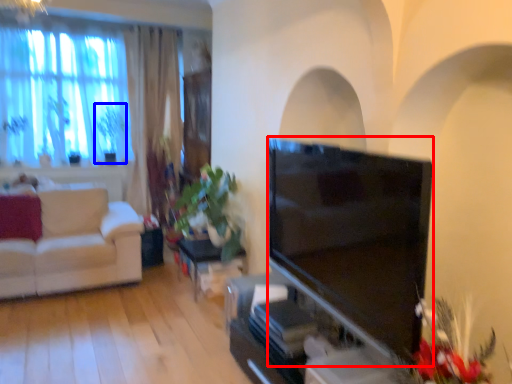
Question: Which object appears farthest to the camera in this image, television (highlighted by a red box) or plant (highlighted by a blue box)?

Choices:
 (A) television
 (B) plant

Answer: (B)